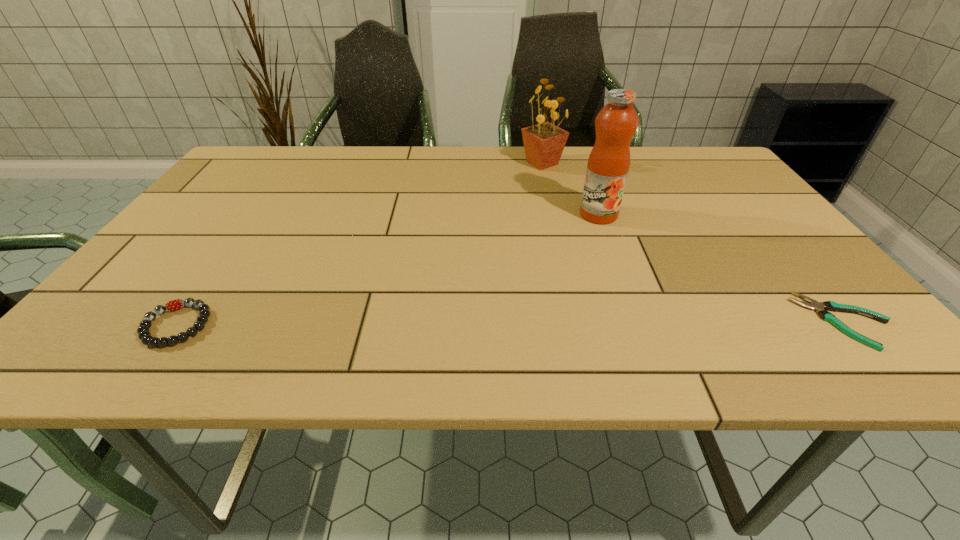
Where is `free space located on the front label of the tallest object`? This screenshot has height=540, width=960. free space located on the front label of the tallest object is located at coordinates (593, 262).

Image resolution: width=960 pixels, height=540 pixels. What are the coordinates of `vacant position located 0.250m on the front label of the tallest object` in the screenshot? It's located at (590, 293).

Identify the location of blank space located on the front label of the tallest object. The height and width of the screenshot is (540, 960). (590, 296).

This screenshot has height=540, width=960. What are the coordinates of `free space located at the front of the second tallest object with flowers visible` in the screenshot? It's located at (535, 197).

Find the location of a particular element. vacant space located at the front of the second tallest object with flowers visible is located at coordinates (525, 235).

You are a GUI agent. You are given a task and a screenshot of the screen. Output one action in this format:
    pyautogui.click(x=<x>, y=<y>)
    Task: Click on the free location located 0.380m at the front of the second tallest object with flowers visible
    
    Given the screenshot: What is the action you would take?
    pyautogui.click(x=521, y=253)

Find the location of `object located in the far edge section of the desktop`. object located in the far edge section of the desktop is located at coordinates (544, 143).

What are the coordinates of `bracelet positioned at the near edge` in the screenshot? It's located at (x=144, y=335).

You are a GUI agent. You are given a task and a screenshot of the screen. Output one action in this format:
    pyautogui.click(x=<x>, y=<y>)
    Task: Click on the pliers that is positioned at the near edge
    Image resolution: width=960 pixels, height=540 pixels.
    Given the screenshot: What is the action you would take?
    pyautogui.click(x=814, y=305)

This screenshot has width=960, height=540. What are the coordinates of `object that is at the left edge` in the screenshot? It's located at (144, 335).